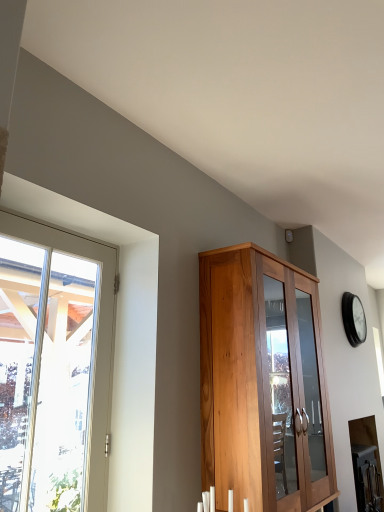
This screenshot has width=384, height=512. In order to click on black glass clock at upper right in this screenshot , I will do `click(354, 319)`.

Where is `black glass clock at upper right`? The height and width of the screenshot is (512, 384). black glass clock at upper right is located at coordinates (354, 319).

Is point (293, 372) positioned in front of point (366, 327)?

Yes, point (293, 372) is in front of point (366, 327).

From the image's perspective, is wooden cabinet at center above or below black glass clock at upper right?

From the image's perspective, wooden cabinet at center appears below black glass clock at upper right.

From a real-world perspective, who is located lower, wooden cabinet at center or black glass clock at upper right?

wooden cabinet at center is physically lower.

Considering the positions of objects black glass clock at upper right and wooden cabinet at center in the image provided, who is behind, black glass clock at upper right or wooden cabinet at center?

black glass clock at upper right is further from the camera.

In terms of height, does black glass clock at upper right look taller or shorter compared to wooden cabinet at center?

Considering their sizes, black glass clock at upper right has less height than wooden cabinet at center.

Based on their sizes in the image, would you say black glass clock at upper right is bigger or smaller than wooden cabinet at center?

Considering their sizes, black glass clock at upper right takes up less space than wooden cabinet at center.

There is a wooden cabinet at center. What are the coordinates of `clock above it (from a real-world perspective)` in the screenshot? It's located at pyautogui.click(x=354, y=319).

Is clear glass window at left aimed at wooden cabinet at center?

No, clear glass window at left does not turn towards wooden cabinet at center.

Between clear glass window at left and wooden cabinet at center, which one has more height?

wooden cabinet at center is taller.

What's the angular difference between clear glass window at left and wooden cabinet at center's facing directions?

The angle between the facing direction of clear glass window at left and the facing direction of wooden cabinet at center is 0.192 degrees.

Is wooden cabinet at center positioned with its back to clear glass window at left?

No, clear glass window at left is not at the back of wooden cabinet at center.

Is the depth of wooden cabinet at center less than that of clear glass window at left?

No, wooden cabinet at center is further to the viewer.

Is wooden cabinet at center touching clear glass window at left?

No, wooden cabinet at center is not touching clear glass window at left.

Does clear glass window at left turn towards black glass clock at upper right?

No, clear glass window at left is not aimed at black glass clock at upper right.

From a real-world perspective, is clear glass window at left located higher than black glass clock at upper right?

No, from a real-world perspective, clear glass window at left is not on top of black glass clock at upper right.

Can you tell me how much clear glass window at left and black glass clock at upper right differ in facing direction?

0.278 degrees.

Between clear glass window at left and black glass clock at upper right, which one is positioned behind?

black glass clock at upper right is further away from the camera.

In order to click on clock behind the clear glass window at left in this screenshot , I will do `click(354, 319)`.

Is black glass clock at upper right facing away from clear glass window at left?

No, black glass clock at upper right is not facing away from clear glass window at left.

Can you confirm if black glass clock at upper right is taller than clear glass window at left?

No, black glass clock at upper right is not taller than clear glass window at left.

Identify the location of clock behind the wooden cabinet at center. The height and width of the screenshot is (512, 384). (354, 319).

Image resolution: width=384 pixels, height=512 pixels. I want to click on clock positioned vertically above the wooden cabinet at center (from a real-world perspective), so click(354, 319).

When comparing their distances from clear glass window at left, does black glass clock at upper right or wooden cabinet at center seem closer?

wooden cabinet at center is closer to clear glass window at left.

From the image, which object appears to be farther from clear glass window at left, wooden cabinet at center or black glass clock at upper right?

black glass clock at upper right is further to clear glass window at left.

Based on their spatial positions, is clear glass window at left or wooden cabinet at center closer to black glass clock at upper right?

Among the two, wooden cabinet at center is located nearer to black glass clock at upper right.

Consider the image. When comparing their distances from black glass clock at upper right, does wooden cabinet at center or clear glass window at left seem closer?

wooden cabinet at center lies closer to black glass clock at upper right than the other object.

Based on their spatial positions, is clear glass window at left or black glass clock at upper right further from wooden cabinet at center?

black glass clock at upper right is positioned further to the anchor wooden cabinet at center.

When comparing their distances from wooden cabinet at center, does black glass clock at upper right or clear glass window at left seem further?

black glass clock at upper right is further to wooden cabinet at center.

The width and height of the screenshot is (384, 512). What are the coordinates of `cupboard between clear glass window at left and black glass clock at upper right from front to back` in the screenshot? It's located at (263, 383).